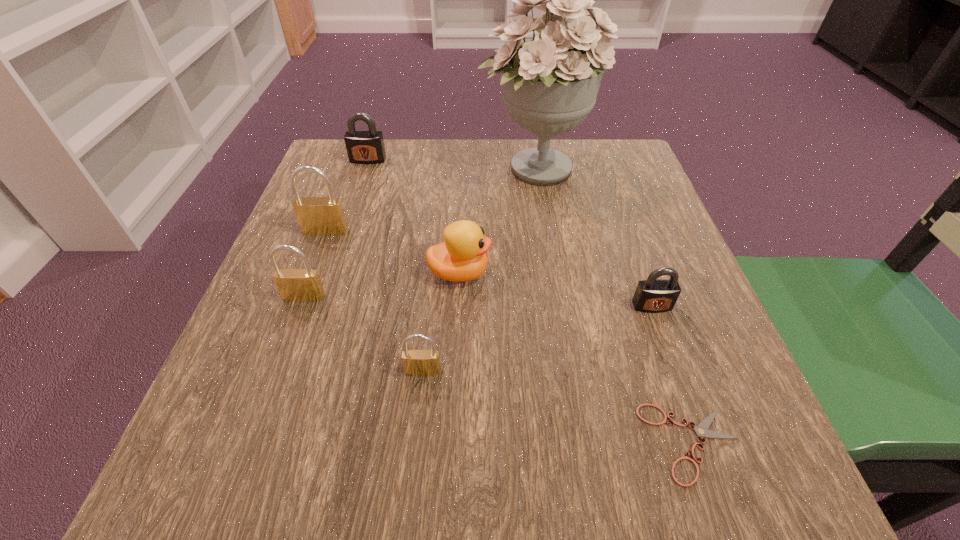
This screenshot has width=960, height=540. What are the coordinates of `the second closest padlock to the second nearest object` in the screenshot? It's located at (653, 295).

Locate which padlock ranks third in proximity to the second nearest object. Please provide its 2D coordinates. Your answer should be formatted as a tuple, i.e. [(x, y)], where the tuple contains the x and y coordinates of a point satisfying the conditions above.

[(323, 216)]

Locate an element on the screen. brass padlock that stands as the closest to the second padlock from right to left is located at coordinates (296, 285).

Where is `brass padlock that is the second closest one to the sixth nearest object`? The height and width of the screenshot is (540, 960). brass padlock that is the second closest one to the sixth nearest object is located at coordinates (416, 362).

Find the location of a particular element. The image size is (960, 540). free space that satisfies the following two spatial constraints: 1. on the front-facing side of the shears; 2. on the left side of the second biggest brass padlock is located at coordinates (251, 443).

Find the location of a particular element. This screenshot has height=540, width=960. vacant space that satisfies the following two spatial constraints: 1. on the front-facing side of the biggest brass padlock; 2. on the right side of the shortest object is located at coordinates (246, 443).

The width and height of the screenshot is (960, 540). I want to click on vacant position in the image that satisfies the following two spatial constraints: 1. on the front-facing side of the shears; 2. on the right side of the smallest brass padlock, so click(416, 443).

Where is `vacant point that satisfies the following two spatial constraints: 1. on the front-facing side of the shears; 2. on the right side of the second biggest brass padlock`? The height and width of the screenshot is (540, 960). vacant point that satisfies the following two spatial constraints: 1. on the front-facing side of the shears; 2. on the right side of the second biggest brass padlock is located at coordinates (251, 443).

At what (x,y) coordinates should I click in order to perform the action: click on vacant space that satisfies the following two spatial constraints: 1. on the front side of the green bouquet; 2. on the face of the duckling. Please return your answer as a coordinate pair (x, y). This screenshot has height=540, width=960. Looking at the image, I should click on (550, 273).

Where is `vacant space that satisfies the following two spatial constraints: 1. on the front of the bigger gray padlock near the keyhole; 2. on the left side of the nearest object`? Image resolution: width=960 pixels, height=540 pixels. vacant space that satisfies the following two spatial constraints: 1. on the front of the bigger gray padlock near the keyhole; 2. on the left side of the nearest object is located at coordinates (275, 443).